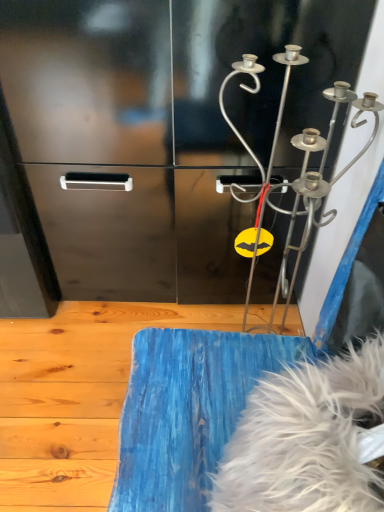
Question: Is point (102, 439) closer or farther from the camera than point (253, 93)?

Choices:
 (A) closer
 (B) farther

Answer: (B)

Question: In terms of width, does blue painted wood at lower center look wider or thinner when compared to silver metallic wind chime at upper right?

Choices:
 (A) thin
 (B) wide

Answer: (B)

Question: Which object is the farthest from the white fluffy feather at lower right?

Choices:
 (A) blue painted wood at lower center
 (B) silver metallic wind chime at upper right

Answer: (A)

Question: Which object is the farthest from the silver metallic wind chime at upper right?

Choices:
 (A) white fluffy feather at lower right
 (B) blue painted wood at lower center

Answer: (B)